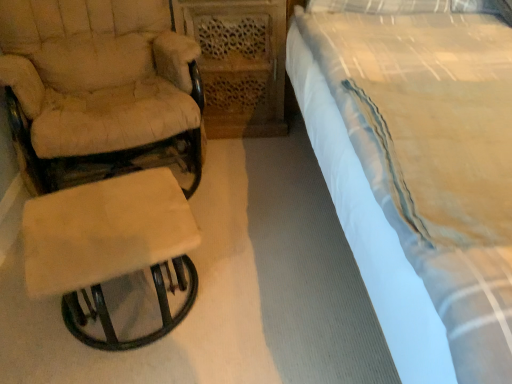
Question: Looking at their shapes, would you say beige fabric stool at left is wider or thinner than white cotton bed at right?

Choices:
 (A) wide
 (B) thin

Answer: (B)

Question: Relative to white cotton bed at right, is beige fabric stool at left in front or behind?

Choices:
 (A) behind
 (B) front

Answer: (A)

Question: Estimate the real-world distances between objects in this image. Which object is closer to the beige fabric chair at left?

Choices:
 (A) beige fabric stool at left
 (B) white cotton bed at right

Answer: (A)

Question: Which object is positioned farthest from the white cotton bed at right?

Choices:
 (A) beige fabric stool at left
 (B) beige fabric chair at left

Answer: (B)